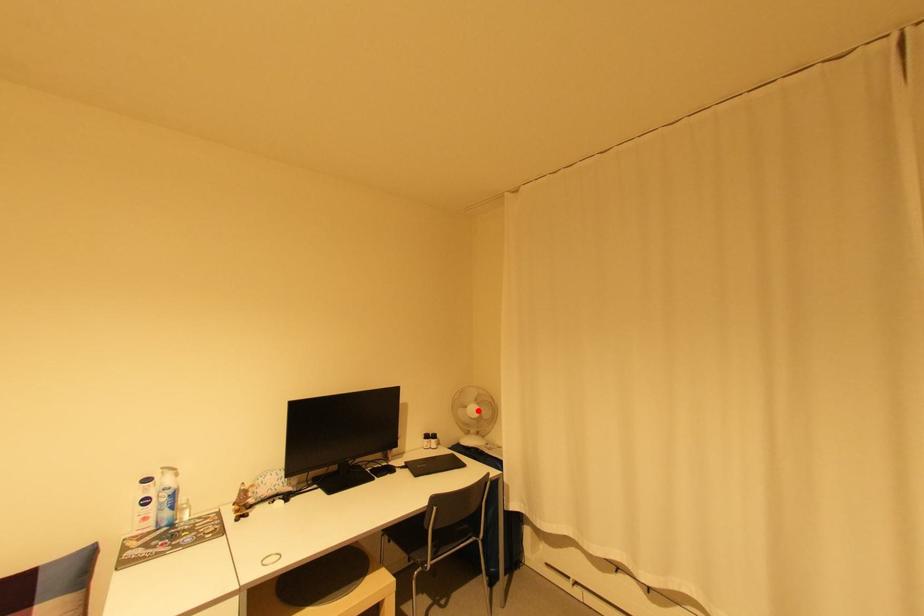
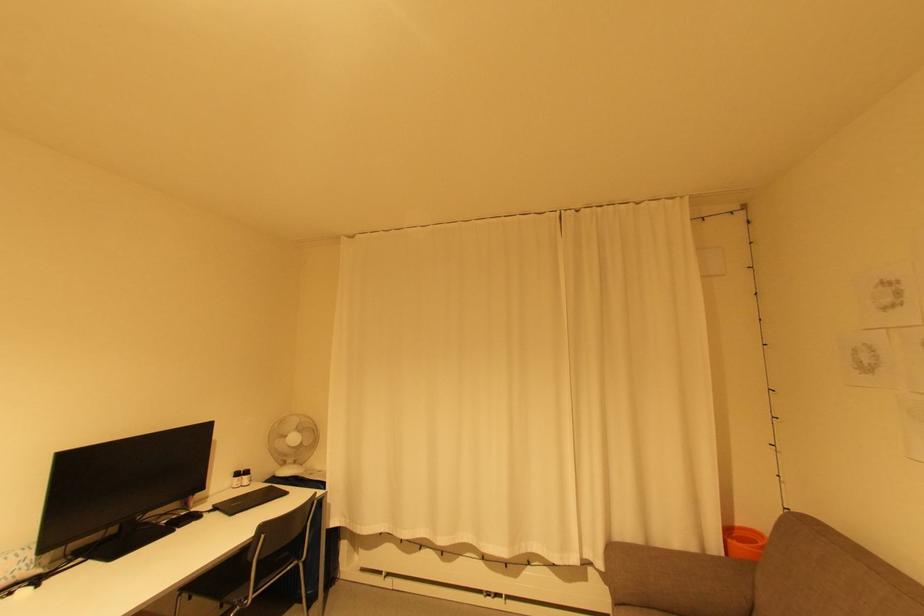
Question: A red point is marked in image1. In image2, is the corresponding 3D point closer to the camera or farther? Reply with the corresponding letter.

Choices:
 (A) The corresponding 3D point is closer.
 (B) The corresponding 3D point is farther.

Answer: (A)